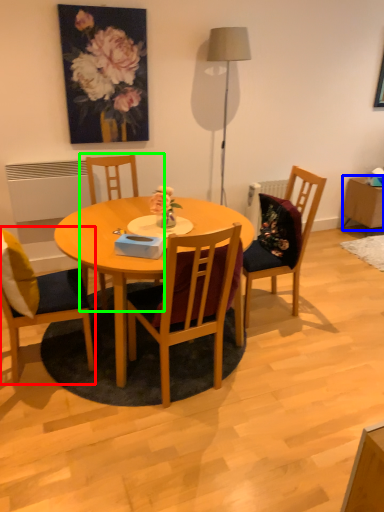
Question: Which object is positioned closest to chair (highlighted by a red box)? Select from side table (highlighted by a blue box) and chair (highlighted by a green box).

Choices:
 (A) side table
 (B) chair

Answer: (B)